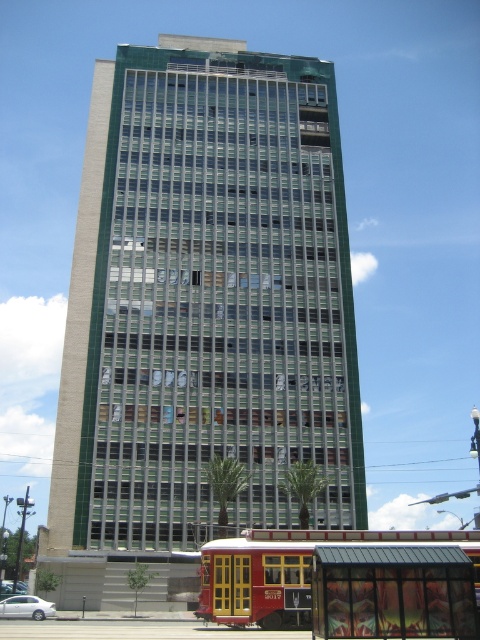
Question: Does green glass building at center appear under white matte car at lower left?

Choices:
 (A) no
 (B) yes

Answer: (A)

Question: Which object is positioned closest to the green glass building at center?

Choices:
 (A) white matte car at lower left
 (B) red polished wood bus at lower center

Answer: (B)

Question: Can you confirm if green glass building at center is positioned below red polished wood bus at lower center?

Choices:
 (A) yes
 (B) no

Answer: (B)

Question: Among these points, which one is farthest from the camera?

Choices:
 (A) (26, 605)
 (B) (215, 564)

Answer: (A)

Question: Which of these objects is positioned farthest from the red polished wood bus at lower center?

Choices:
 (A) green glass building at center
 (B) metallic glass bus stop at lower center

Answer: (A)

Question: Is green glass building at center further to camera compared to white matte car at lower left?

Choices:
 (A) yes
 (B) no

Answer: (A)